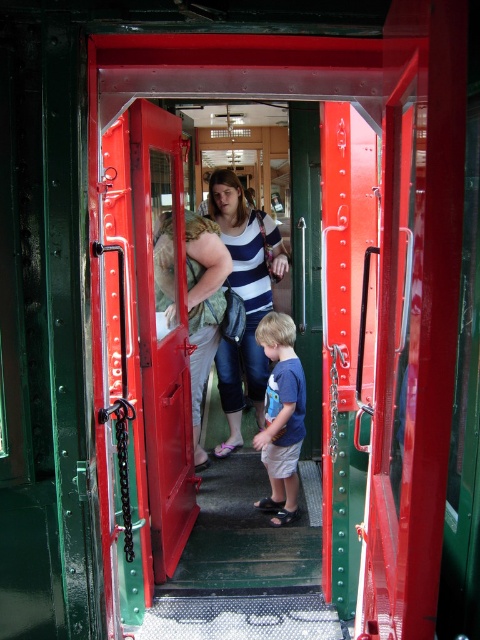
Question: Which point is farther from the camera taking this photo?

Choices:
 (A) (277, 369)
 (B) (222, 237)
 (C) (132, 179)
 (D) (302, 634)

Answer: (B)

Question: Does metallic grid stair at center have a smaller size compared to blue cotton shirt at center?

Choices:
 (A) no
 (B) yes

Answer: (B)

Question: Does metallic red door at center appear on the right side of blue cotton shirt at center?

Choices:
 (A) no
 (B) yes

Answer: (A)

Question: Which point appears closest to the camera in this image?

Choices:
 (A) [x=229, y=221]
 (B) [x=178, y=253]
 (C) [x=289, y=323]
 (D) [x=160, y=614]

Answer: (D)

Question: In this image, where is metallic red door at center located relative to blue cotton shirt at center?

Choices:
 (A) above
 (B) below

Answer: (A)

Question: Which object appears farthest from the camera in this image?

Choices:
 (A) striped fabric shirt at center
 (B) metallic grid stair at center

Answer: (A)